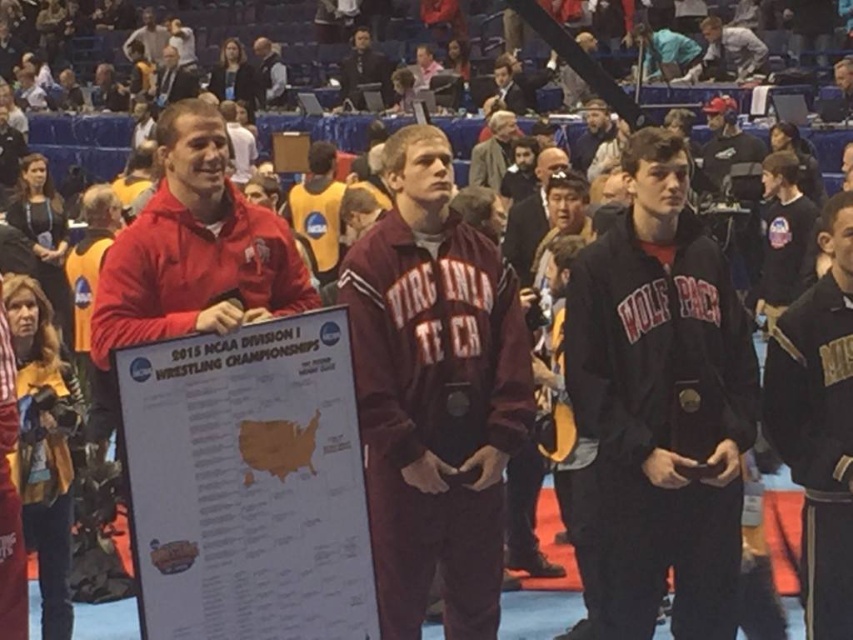
Question: Based on their relative distances, which object is nearer to the wooden plaque at center?

Choices:
 (A) maroon fleece jacket at center
 (B) dark blue jacket at upper center
 (C) gray wool jacket at upper center

Answer: (A)

Question: Which point is closer to the camera?

Choices:
 (A) (267, 529)
 (B) (706, 26)

Answer: (A)

Question: Is dark brown leather jacket at upper center to the right of dark gray vest at upper center from the viewer's perspective?

Choices:
 (A) yes
 (B) no

Answer: (A)

Question: Does black matte jacket at right have a smaller size compared to light blue shirt at center?

Choices:
 (A) yes
 (B) no

Answer: (A)

Question: Considering the relative positions of dark blue jacket at upper center and dark gray vest at upper center in the image provided, where is dark blue jacket at upper center located with respect to dark gray vest at upper center?

Choices:
 (A) left
 (B) right

Answer: (B)

Question: Estimate the real-world distances between objects in this image. Which object is farther from the light blue shirt at center?

Choices:
 (A) dark blue jacket at upper center
 (B) black matte jacket at right
 (C) wooden plaque at center
 (D) matte black suit at upper left

Answer: (C)